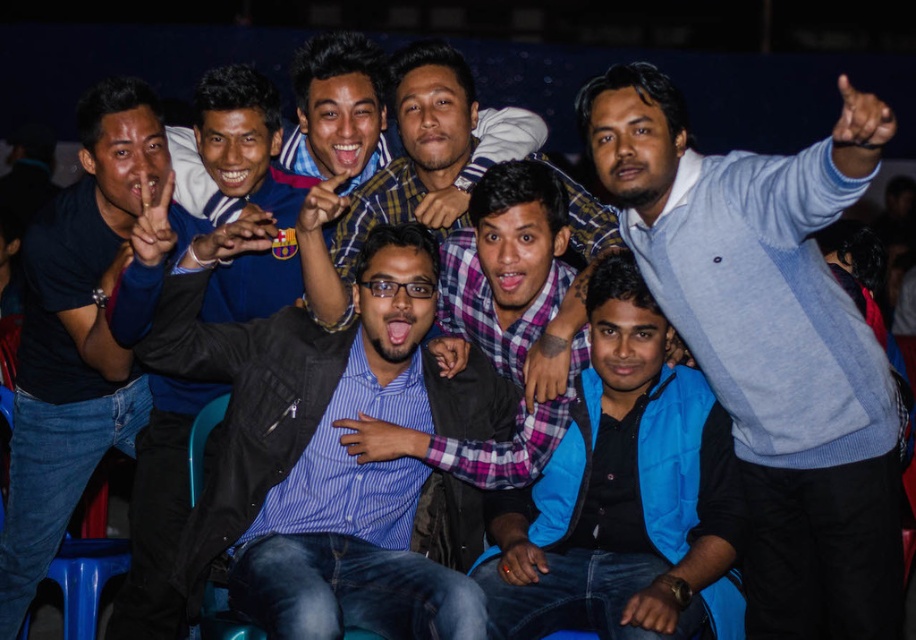
Is light blue sweater at upper right positioned in front of blue fleece jacket at center?

Yes, it is.

Measure the distance between light blue sweater at upper right and blue fleece jacket at center.

A distance of 15.26 inches exists between light blue sweater at upper right and blue fleece jacket at center.

This screenshot has height=640, width=916. What are the coordinates of `light blue sweater at upper right` in the screenshot? It's located at (771, 342).

Identify the location of light blue sweater at upper right. (771, 342).

Where is `blue striped shirt at center`? This screenshot has height=640, width=916. blue striped shirt at center is located at coordinates (328, 452).

Between blue striped shirt at center and blue fleece jacket at center, which one has less height?

blue fleece jacket at center

Measure the distance between point (325, 604) and camera.

Point (325, 604) is 2.23 meters away from camera.

What are the coordinates of `blue striped shirt at center` in the screenshot? It's located at (328, 452).

Is light blue sweater at upper right to the right of blue striped shirt at center from the viewer's perspective?

Indeed, light blue sweater at upper right is positioned on the right side of blue striped shirt at center.

Who is positioned more to the left, light blue sweater at upper right or blue striped shirt at center?

blue striped shirt at center

Which is in front, point (712, 202) or point (269, 476)?

Point (712, 202)

The image size is (916, 640). I want to click on light blue sweater at upper right, so click(771, 342).